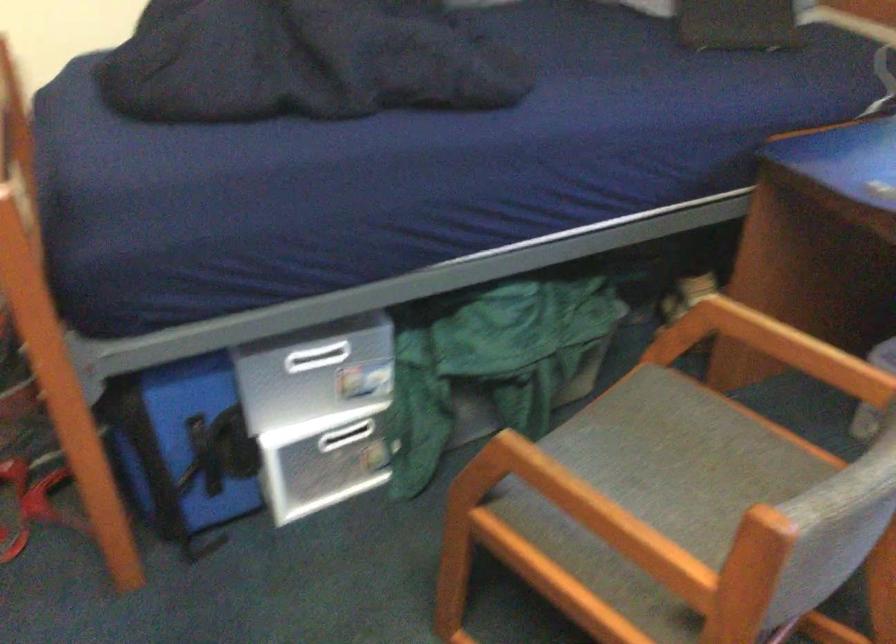
What do you see at coordinates (200, 428) in the screenshot? The width and height of the screenshot is (896, 644). I see `the blue bag handle` at bounding box center [200, 428].